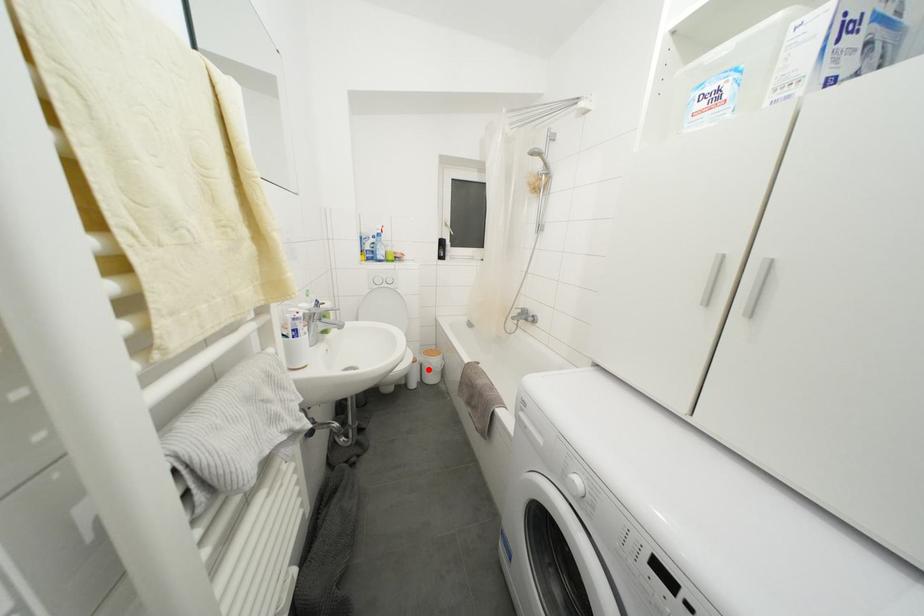
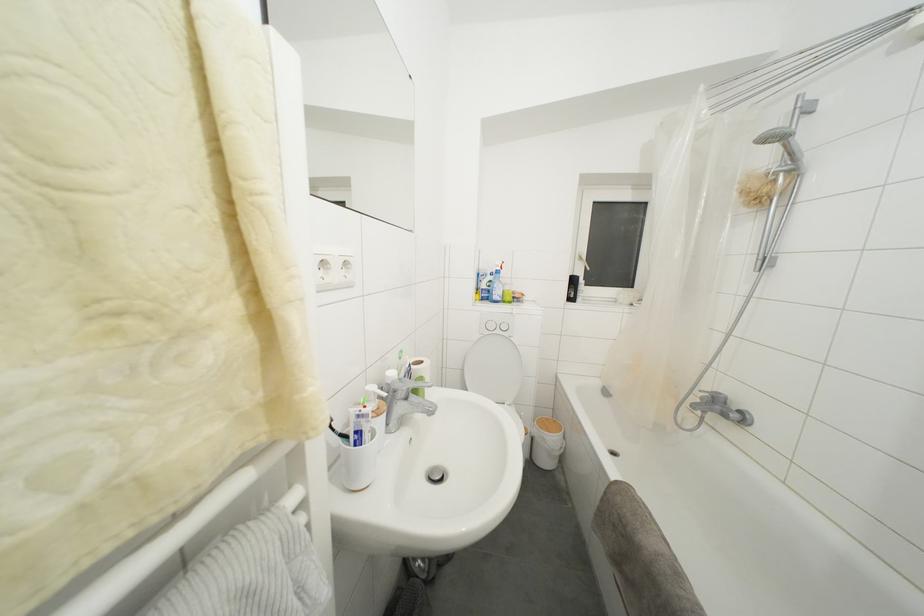
Question: I am providing you with two images of the same scene from different viewpoints. In image1, a red point is highlighted. Considering the same 3D point in image2, which of the following is correct?

Choices:
 (A) It is closer
 (B) It is farther

Answer: (B)